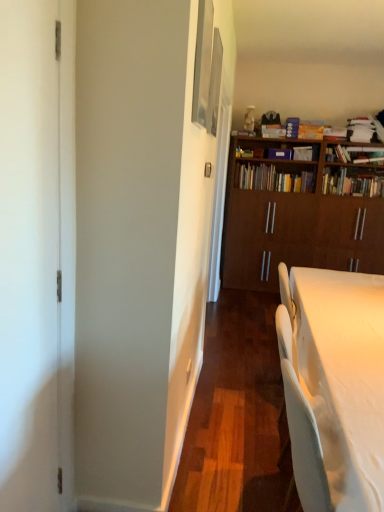
What do you see at coordinates (353, 183) in the screenshot?
I see `wooden bookshelf at upper right, the first book positioned from the right` at bounding box center [353, 183].

Image resolution: width=384 pixels, height=512 pixels. What do you see at coordinates (37, 253) in the screenshot?
I see `white glossy door at left` at bounding box center [37, 253].

Measure the distance between white glossy door at left and camera.

The distance of white glossy door at left from camera is 38.13 inches.

Measure the distance between white glossy desk at lower right and camera.

The depth of white glossy desk at lower right is 36.18 inches.

Locate an element on the screen. Image resolution: width=384 pixels, height=512 pixels. metallic silver picture frame at upper center, acting as the second picture frame starting from the back is located at coordinates [x=203, y=62].

Locate an element on the screen. This screenshot has width=384, height=512. wooden bookshelf at upper right, the first book positioned from the right is located at coordinates (353, 183).

Is wooden bookshelf at upper right, positioned as the 3th book in left-to-right order, facing towards wooden bookshelf at center, the first book positioned from the left?

No, wooden bookshelf at upper right, positioned as the 3th book in left-to-right order, does not turn towards wooden bookshelf at center, the first book positioned from the left.

Is wooden bookshelf at upper right, the first book positioned from the right, taller or shorter than wooden bookshelf at center, the first book positioned from the left?

Clearly, wooden bookshelf at upper right, the first book positioned from the right, is shorter compared to wooden bookshelf at center, the first book positioned from the left.

From a real-world perspective, which is physically below, wooden bookshelf at upper right, the first book positioned from the right, or wooden bookshelf at center, the first book positioned from the left?

From a 3D spatial view, wooden bookshelf at center, the first book positioned from the left, is below.

Is wooden bookshelf at upper right, the first book positioned from the right, smaller than wooden bookshelf at center, the first book positioned from the left?

Actually, wooden bookshelf at upper right, the first book positioned from the right, might be larger than wooden bookshelf at center, the first book positioned from the left.

Considering the relative sizes of metallic silver picture frame at upper center, acting as the second picture frame starting from the back, and brown wood bookcase at upper right in the image provided, is metallic silver picture frame at upper center, acting as the second picture frame starting from the back, bigger than brown wood bookcase at upper right?

No, metallic silver picture frame at upper center, acting as the second picture frame starting from the back, is not bigger than brown wood bookcase at upper right.

Considering the sizes of metallic silver picture frame at upper center, acting as the 1th picture frame starting from the front, and brown wood bookcase at upper right in the image, is metallic silver picture frame at upper center, acting as the 1th picture frame starting from the front, wider or thinner than brown wood bookcase at upper right?

Clearly, metallic silver picture frame at upper center, acting as the 1th picture frame starting from the front, has less width compared to brown wood bookcase at upper right.

Considering the sizes of objects metallic silver picture frame at upper center, acting as the 1th picture frame starting from the front, and brown wood bookcase at upper right in the image provided, who is taller, metallic silver picture frame at upper center, acting as the 1th picture frame starting from the front, or brown wood bookcase at upper right?

brown wood bookcase at upper right is taller.

From a real-world perspective, is metallic silver picture frame at upper center, acting as the second picture frame starting from the back, over brown wood bookcase at upper right?

Yes.

Considering the relative sizes of white glossy door at left and metallic silver picture frame at upper center, the 1th picture frame when ordered from back to front, in the image provided, is white glossy door at left wider than metallic silver picture frame at upper center, the 1th picture frame when ordered from back to front,?

Correct, the width of white glossy door at left exceeds that of metallic silver picture frame at upper center, the 1th picture frame when ordered from back to front.

Between white glossy door at left and metallic silver picture frame at upper center, the 1th picture frame when ordered from back to front, which one is positioned behind?

metallic silver picture frame at upper center, the 1th picture frame when ordered from back to front.

Find the location of a particular element. The image size is (384, 512). screen door below the metallic silver picture frame at upper center, the 1th picture frame when ordered from back to front (from a real-world perspective) is located at coordinates (37, 253).

Is metallic silver picture frame at upper center, which is the 2th picture frame in front-to-back order, inside white glossy door at left?

No, metallic silver picture frame at upper center, which is the 2th picture frame in front-to-back order, is not a part of white glossy door at left.

Between brown wood bookcase at upper right and metallic silver picture frame at upper center, acting as the 1th picture frame starting from the front, which one has smaller width?

metallic silver picture frame at upper center, acting as the 1th picture frame starting from the front, is thinner.

There is a brown wood bookcase at upper right. At what (x,y) coordinates should I click in order to perform the action: click on the 1st picture frame above it (from the image's perspective). Please return your answer as a coordinate pair (x, y). This screenshot has width=384, height=512. Looking at the image, I should click on (203, 62).

From a real-world perspective, which object stands above the other?

metallic silver picture frame at upper center, acting as the second picture frame starting from the back, from a real-world perspective.

From the image's perspective, would you say brown wood bookcase at upper right is positioned over metallic silver picture frame at upper center, acting as the 1th picture frame starting from the front?

Actually, brown wood bookcase at upper right appears below metallic silver picture frame at upper center, acting as the 1th picture frame starting from the front, in the image.

Would you say wooden bookshelf at center, the third book in the right-to-left sequence, is outside metallic silver picture frame at upper center, which is the 2th picture frame in front-to-back order?

Yes, wooden bookshelf at center, the third book in the right-to-left sequence, is not within metallic silver picture frame at upper center, which is the 2th picture frame in front-to-back order.

Considering their positions, is wooden bookshelf at center, the third book in the right-to-left sequence, located in front of or behind metallic silver picture frame at upper center, the 1th picture frame when ordered from back to front?

In the image, wooden bookshelf at center, the third book in the right-to-left sequence, appears behind metallic silver picture frame at upper center, the 1th picture frame when ordered from back to front.

What's the angular difference between wooden bookshelf at center, the first book positioned from the left, and metallic silver picture frame at upper center, the 1th picture frame when ordered from back to front,'s facing directions?

There is a 90.2-degree angle between the facing directions of wooden bookshelf at center, the first book positioned from the left, and metallic silver picture frame at upper center, the 1th picture frame when ordered from back to front.

Can you confirm if wooden bookshelf at center, the first book positioned from the left, is bigger than metallic silver picture frame at upper center, which is the 2th picture frame in front-to-back order?

Correct, wooden bookshelf at center, the first book positioned from the left, is larger in size than metallic silver picture frame at upper center, which is the 2th picture frame in front-to-back order.

Which object is wider, wooden bookshelf at center, the third book in the right-to-left sequence, or white glossy door at left?

Wider between the two is wooden bookshelf at center, the third book in the right-to-left sequence.

From a real-world perspective, which is physically below, wooden bookshelf at center, the first book positioned from the left, or white glossy door at left?

white glossy door at left.

Which is in front, wooden bookshelf at center, the third book in the right-to-left sequence, or white glossy door at left?

white glossy door at left is more forward.

Considering the relative sizes of white glossy desk at lower right and wooden bookshelf at upper right, positioned as the 3th book in left-to-right order, in the image provided, is white glossy desk at lower right smaller than wooden bookshelf at upper right, positioned as the 3th book in left-to-right order,?

No, white glossy desk at lower right is not smaller than wooden bookshelf at upper right, positioned as the 3th book in left-to-right order.

This screenshot has height=512, width=384. Identify the location of desk to the left of wooden bookshelf at upper right, positioned as the 3th book in left-to-right order. (341, 385).

Considering the sizes of objects white glossy desk at lower right and wooden bookshelf at upper right, the first book positioned from the right, in the image provided, who is thinner, white glossy desk at lower right or wooden bookshelf at upper right, the first book positioned from the right,?

With smaller width is wooden bookshelf at upper right, the first book positioned from the right.

Between white glossy desk at lower right and wooden bookshelf at upper right, the first book positioned from the right, which one is positioned in front?

white glossy desk at lower right is more forward.

Image resolution: width=384 pixels, height=512 pixels. What are the coordinates of `book directly beneath the wooden bookshelf at upper right, the first book positioned from the right (from a real-world perspective)` in the screenshot? It's located at click(x=272, y=179).

From a real-world perspective, count 1st picture frames upward from the brown wood bookcase at upper right and point to it. Please provide its 2D coordinates.

[(203, 62)]

Estimate the real-world distances between objects in this image. Which object is closer to white glossy desk at lower right, hardcover book at upper right, which is counted as the second book, starting from the left, or wooden bookshelf at center, the first book positioned from the left?

wooden bookshelf at center, the first book positioned from the left, is positioned closer to the anchor white glossy desk at lower right.

When comparing their distances from brown wood bookcase at upper right, does white glossy door at left or white glossy desk at lower right seem further?

Among the two, white glossy door at left is located further to brown wood bookcase at upper right.

Looking at this image, based on their spatial positions, is metallic silver picture frame at upper center, the 1th picture frame when ordered from back to front, or wooden bookshelf at center, the third book in the right-to-left sequence, closer to hardcover book at upper right, the second book from the right?

wooden bookshelf at center, the third book in the right-to-left sequence, is positioned closer to the anchor hardcover book at upper right, the second book from the right.

Based on their spatial positions, is white glossy door at left or wooden bookshelf at center, the first book positioned from the left, closer to wooden bookshelf at upper right, positioned as the 3th book in left-to-right order?

Among the two, wooden bookshelf at center, the first book positioned from the left, is located nearer to wooden bookshelf at upper right, positioned as the 3th book in left-to-right order.

Looking at the image, which one is located further to white glossy desk at lower right, brown wood bookcase at upper right or metallic silver picture frame at upper center, the 1th picture frame when ordered from back to front?

brown wood bookcase at upper right is further to white glossy desk at lower right.

Which object lies further to the anchor point metallic silver picture frame at upper center, acting as the 1th picture frame starting from the front, metallic silver picture frame at upper center, the 1th picture frame when ordered from back to front, or wooden bookshelf at center, the first book positioned from the left?

Among the two, wooden bookshelf at center, the first book positioned from the left, is located further to metallic silver picture frame at upper center, acting as the 1th picture frame starting from the front.

Considering their positions, is white glossy desk at lower right positioned further to brown wood bookcase at upper right than hardcover book at upper right, which is counted as the second book, starting from the left?

Based on the image, white glossy desk at lower right appears to be further to brown wood bookcase at upper right.

Based on their spatial positions, is metallic silver picture frame at upper center, acting as the second picture frame starting from the back, or metallic silver picture frame at upper center, the 1th picture frame when ordered from back to front, closer to hardcover book at upper right, which is counted as the second book, starting from the left?

Among the two, metallic silver picture frame at upper center, the 1th picture frame when ordered from back to front, is located nearer to hardcover book at upper right, which is counted as the second book, starting from the left.

Locate an element on the screen. Image resolution: width=384 pixels, height=512 pixels. picture frame between metallic silver picture frame at upper center, acting as the 1th picture frame starting from the front, and wooden bookshelf at upper right, positioned as the 3th book in left-to-right order, along the z-axis is located at coordinates (214, 84).

Find the location of a particular element. The image size is (384, 512). desk positioned between white glossy door at left and metallic silver picture frame at upper center, the 1th picture frame when ordered from back to front, from near to far is located at coordinates (341, 385).

Locate an element on the screen. Image resolution: width=384 pixels, height=512 pixels. bookcase located between white glossy desk at lower right and hardcover book at upper right, which is counted as the second book, starting from the left, in the depth direction is located at coordinates (300, 218).

The image size is (384, 512). In order to click on bookcase between white glossy door at left and wooden bookshelf at upper right, the first book positioned from the right, along the z-axis in this screenshot , I will do `click(300, 218)`.